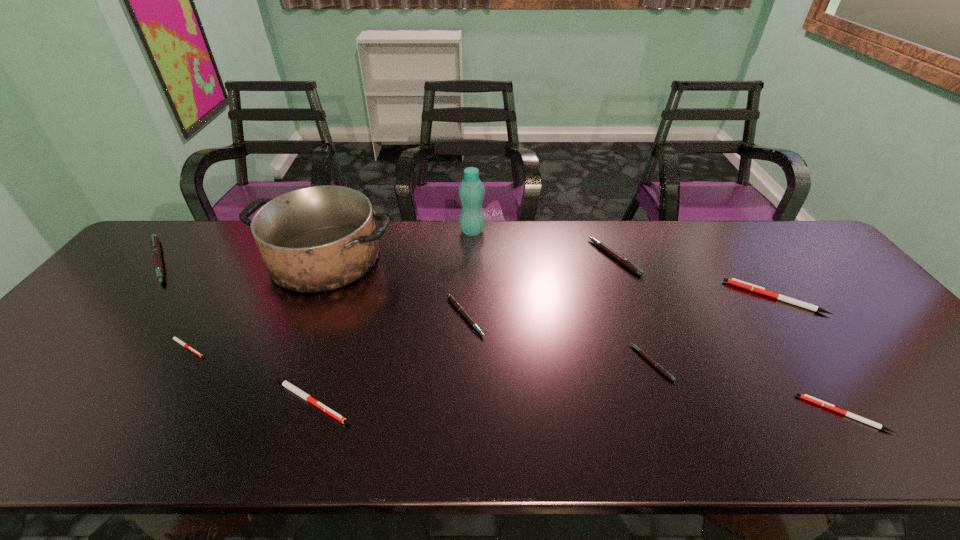
Find the location of a particular element. vacant space located 0.400m on the clicker of the second smallest white pen is located at coordinates coord(620,414).

Where is `vacant space located on the clicker of the shortest pen`? This screenshot has height=540, width=960. vacant space located on the clicker of the shortest pen is located at coordinates (283, 347).

Image resolution: width=960 pixels, height=540 pixels. In order to click on bottle that is at the far edge in this screenshot , I will do `click(471, 191)`.

Where is `saucepan present at the far edge`? saucepan present at the far edge is located at coordinates (315, 239).

Identify the location of object situated at the left edge. This screenshot has width=960, height=540. (155, 245).

Find the location of a particular element. This screenshot has height=540, width=960. object present at the right edge is located at coordinates [733, 281].

The width and height of the screenshot is (960, 540). Identify the location of object positioned at the far left corner. (155, 245).

The width and height of the screenshot is (960, 540). In the image, there is a desktop. Identify the location of vacant space at the far edge. (573, 229).

Find the location of `free space at the near edge of the desktop`. free space at the near edge of the desktop is located at coordinates (111, 449).

At what (x,y) coordinates should I click in order to perform the action: click on vacant space at the right edge. Please return your answer as a coordinate pair (x, y). Looking at the image, I should click on (805, 281).